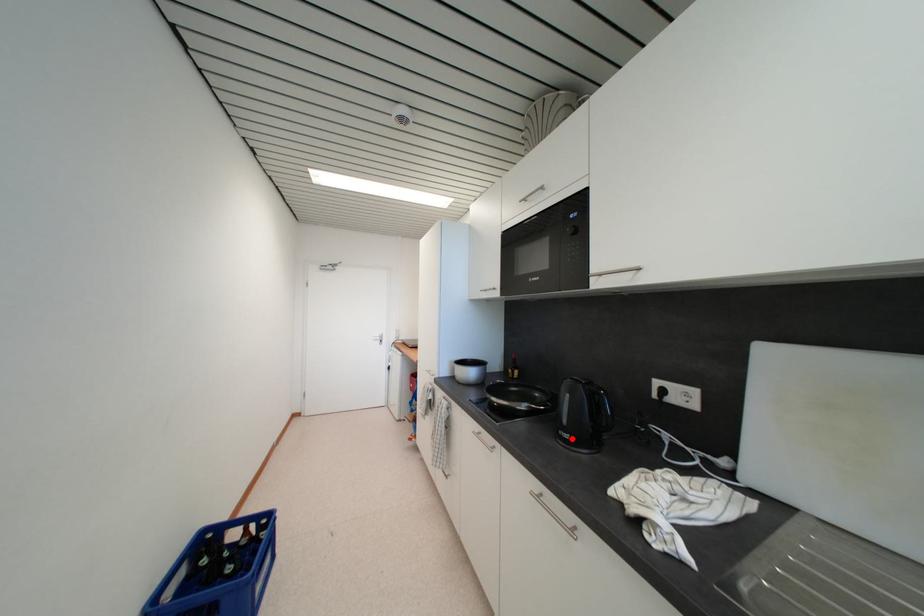
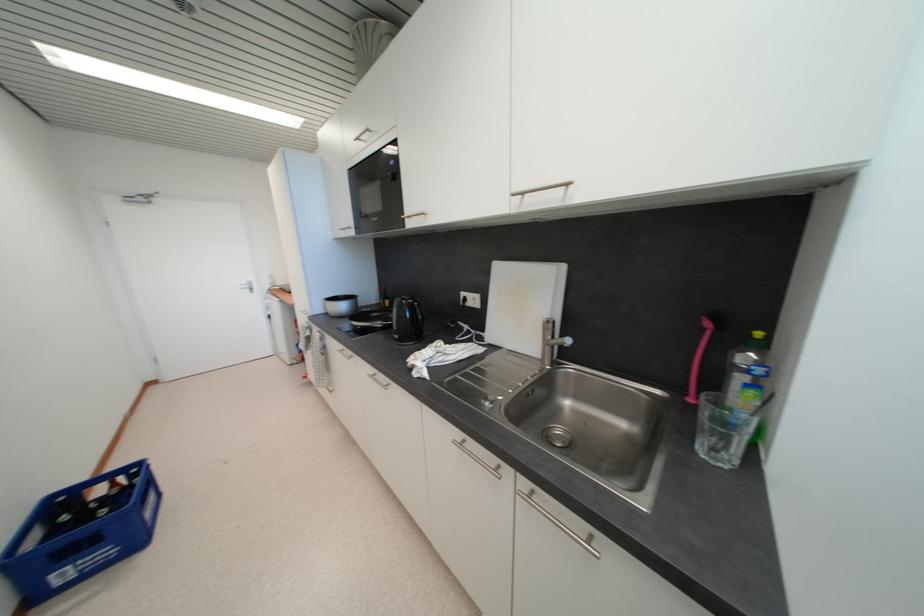
In the second image, find the point that corresponds to the highlighted location in the first image.

(402, 339)